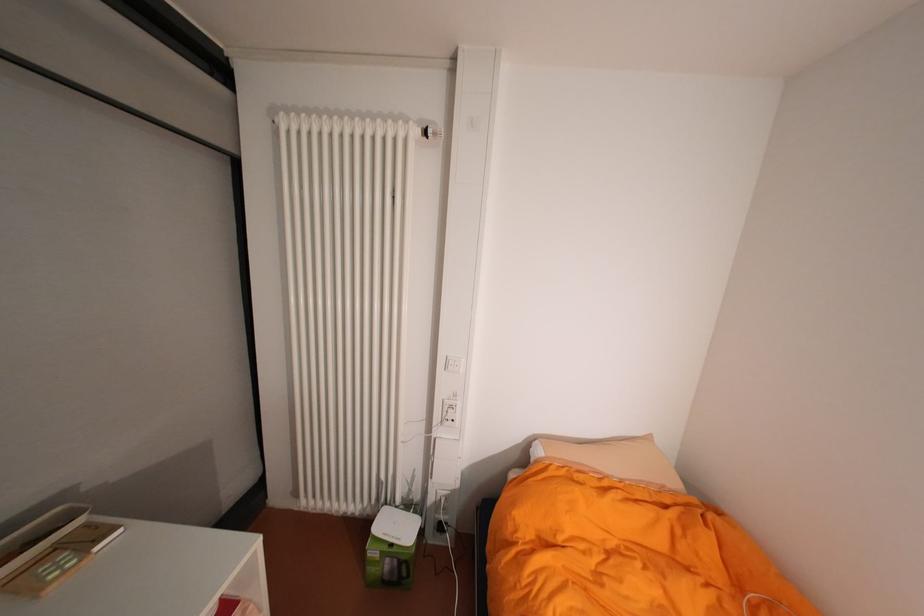
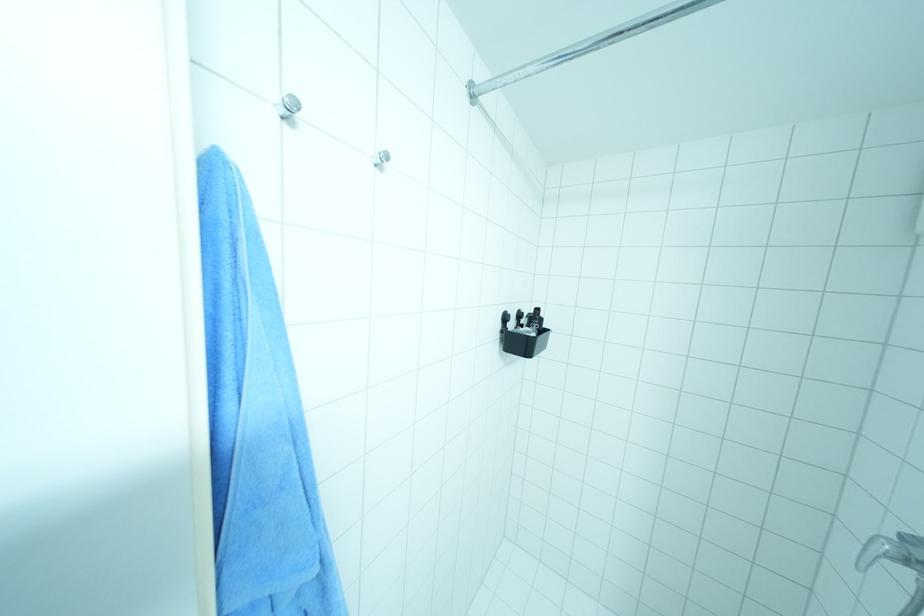
Question: I am providing you with two images of the same scene from different viewpoints. After the viewpoint changes to image2, which objects are now occluded?

Choices:
 (A) shower faucet handle
 (B) white wifi router
 (C) black toothbrush
 (D) grey plastic box

Answer: (B)